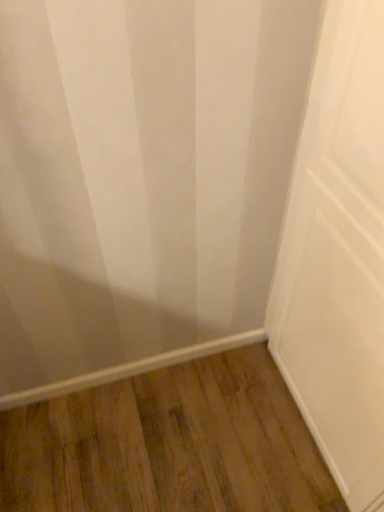
You are a GUI agent. You are given a task and a screenshot of the screen. Output one action in this format:
    pyautogui.click(x=<x>, y=<y>)
    Task: Click on the free spot above brown wood flooring at lower center (from a real-world perspective)
    
    Given the screenshot: What is the action you would take?
    pyautogui.click(x=180, y=438)